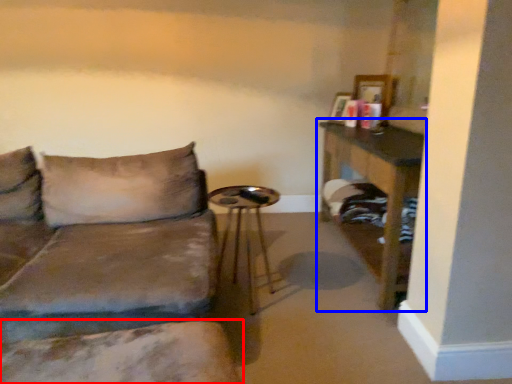
Question: Which point is further to the camera, swivel chair (highlighted by a red box) or table (highlighted by a blue box)?

Choices:
 (A) swivel chair
 (B) table

Answer: (B)